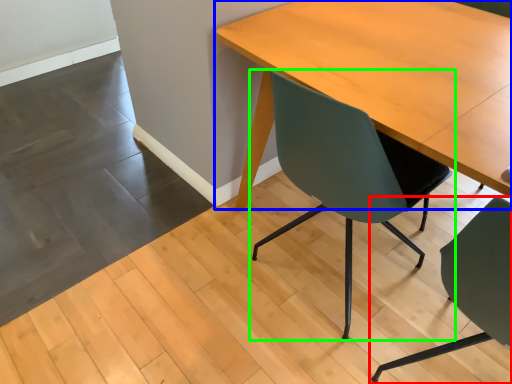
Question: Considering the real-world distances, which object is closest to chair (highlighted by a red box)? table (highlighted by a blue box) or chair (highlighted by a green box).

Choices:
 (A) table
 (B) chair

Answer: (B)